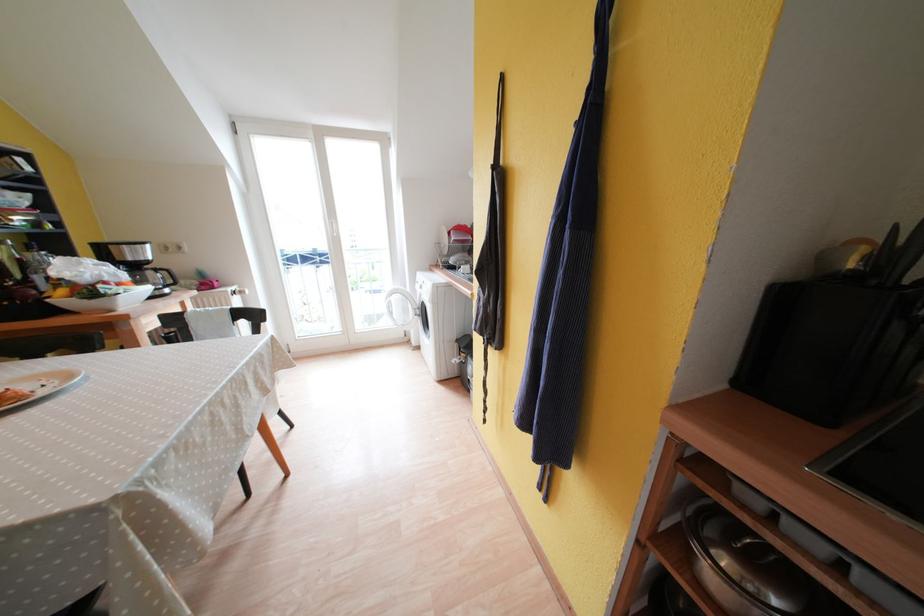
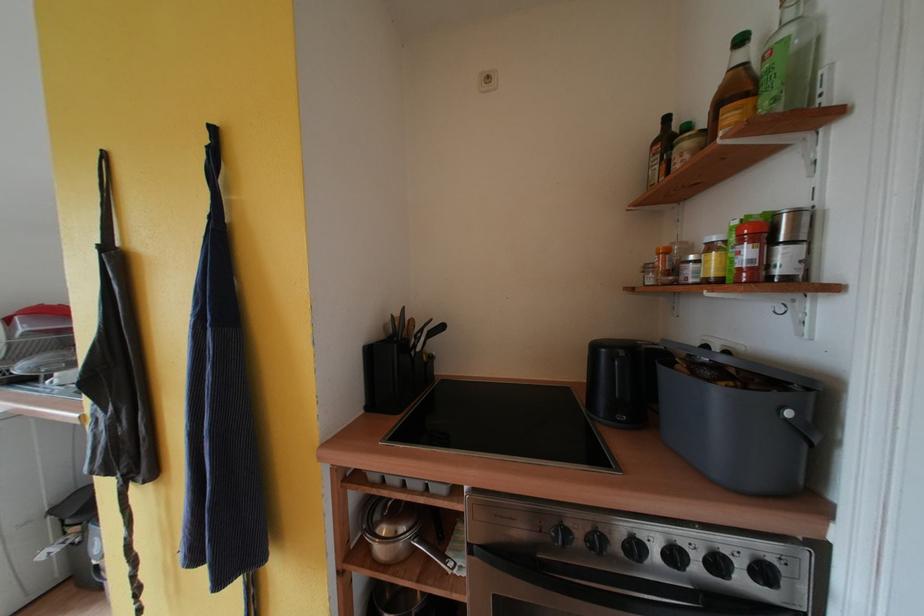
Where in the second image is the point corresponding to pixel 715 533 from the first image?

(383, 521)